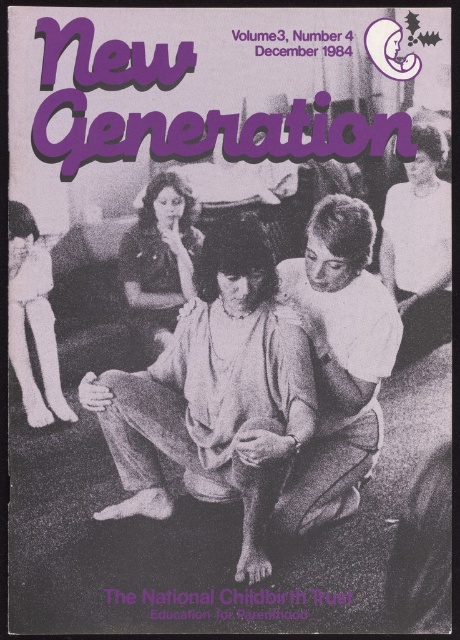
Based on the scene described, where is the white cotton shirt at center located in terms of coordinates?

The white cotton shirt at center is located at coordinates point (214, 397).

From the picture: You are an observer looking at the cover of the publication. You notice two shirts in the image. The white smooth shirt at right and the matte black shirt at center. Which shirt appears taller in the image?

The white smooth shirt at right is much taller as matte black shirt at center.